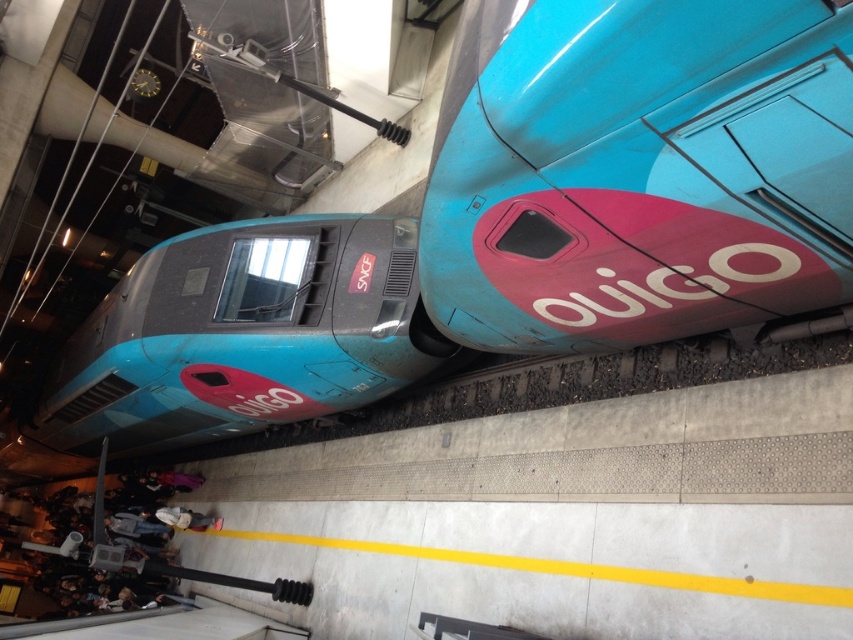
Is shiny blue train at upper right thinner than matte blue train at center?

No.

Can you confirm if shiny blue train at upper right is positioned below matte blue train at center?

No, shiny blue train at upper right is not below matte blue train at center.

Which is behind, point (808, 150) or point (99, 396)?

Point (99, 396)

Locate an element on the screen. The height and width of the screenshot is (640, 853). shiny blue train at upper right is located at coordinates (637, 170).